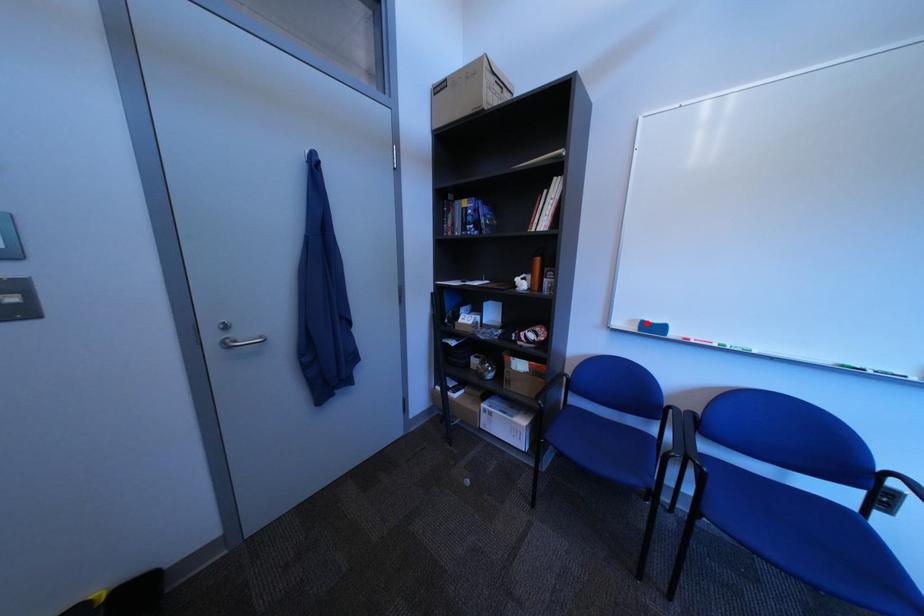
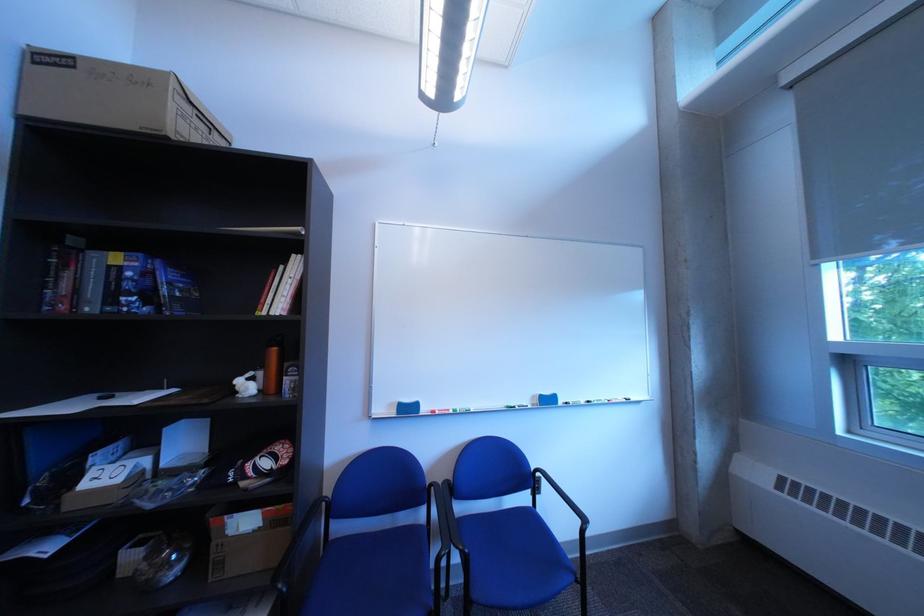
Where in the second image is the point corresponding to the highlighted location from the first image?

(406, 407)